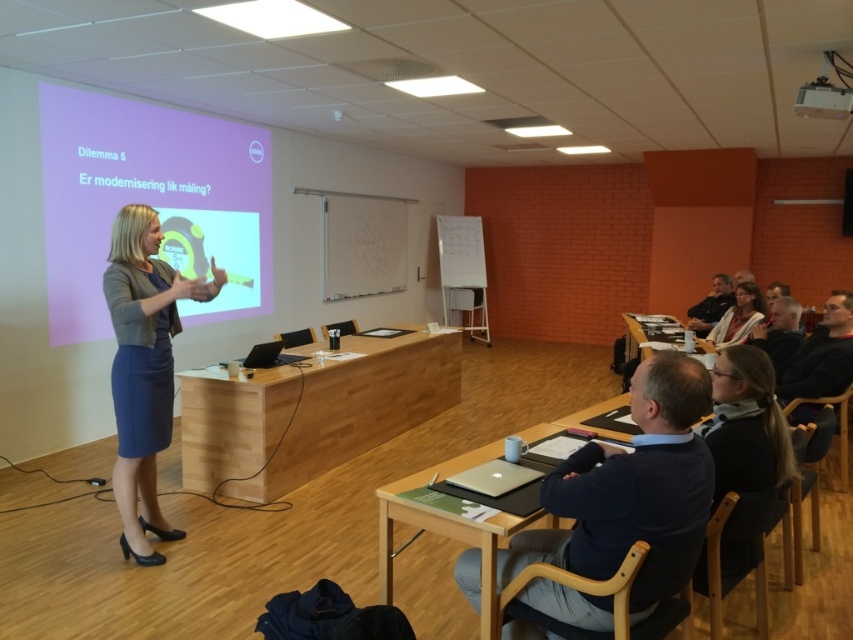
You are an attendee sitting in the conference room and want to determine which of the two points, point [525,593] or point [112,486], is closer to you. Based on the scene, which point is nearer?

Point [525,593] is closer to the viewer than point [112,486].